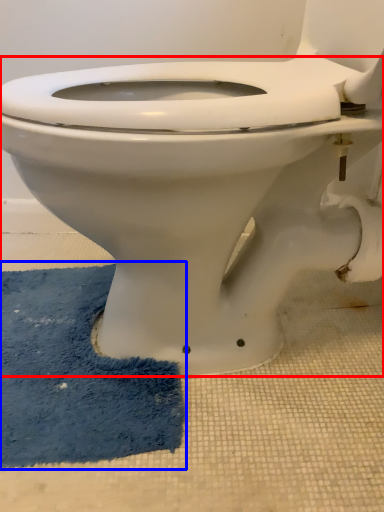
Question: Among these objects, which one is nearest to the camera, toilet (highlighted by a red box) or bath mat (highlighted by a blue box)?

Choices:
 (A) toilet
 (B) bath mat

Answer: (A)